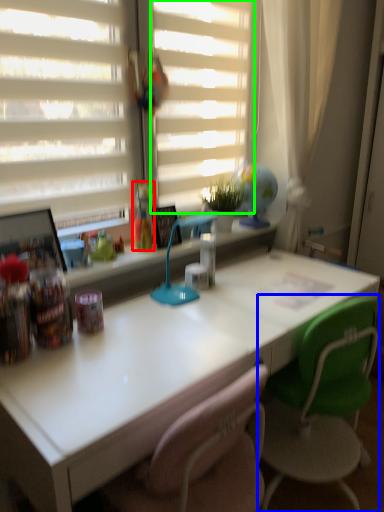
Question: Which object is the closest to the toy (highlighted by a red box)? Choose among these: chair (highlighted by a blue box) or blind (highlighted by a green box).

Choices:
 (A) chair
 (B) blind

Answer: (B)